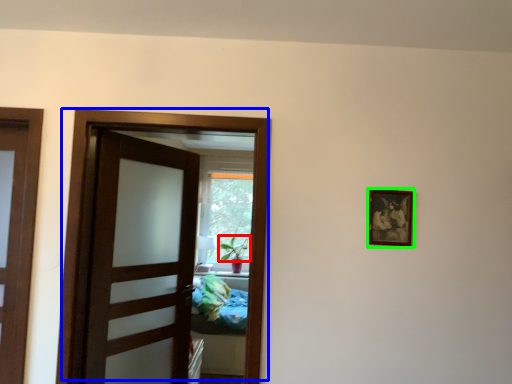
Question: Which is nearer to the plant (highlighted by a red box)? door (highlighted by a blue box) or picture frame (highlighted by a green box).

Choices:
 (A) door
 (B) picture frame

Answer: (A)